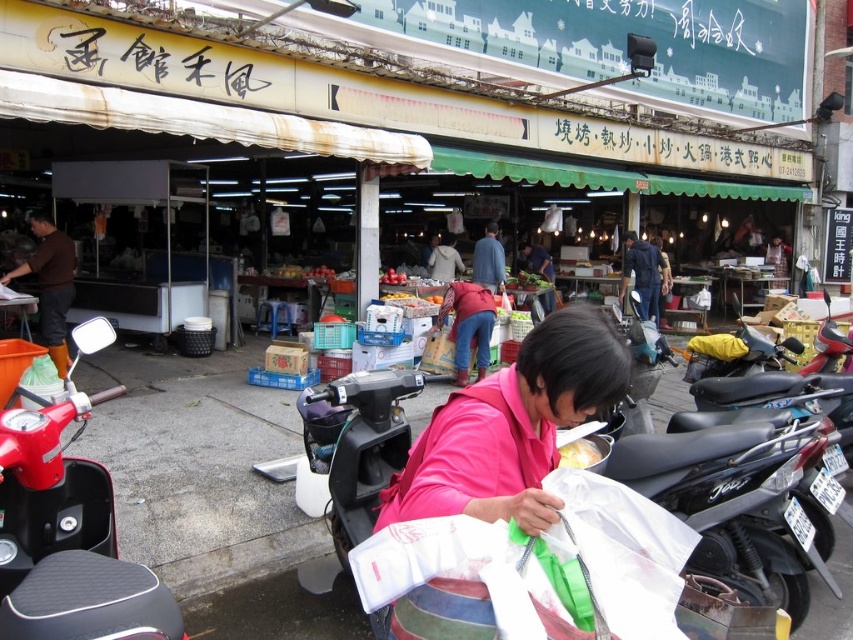
You are a delivery person who needs to place a package on the white glossy bowl at center. You are currently standing next to the black matte scooter at right. Can you reach the bowl without moving from your current position?

The distance between the black matte scooter at right and the white glossy bowl at center is 5.44 feet. Since you are standing next to the scooter, you would need to move approximately 5.44 feet towards the bowl to place the package, so you cannot reach it without moving.

You are standing at the center of the market and want to find the red matte motorcycle at lower left. According to the coordinates provided, in which direction should you move to locate it?

The red matte motorcycle at lower left is located at coordinates point (x=67, y=538). Since you are at the center, you should move towards the lower left direction to find it.